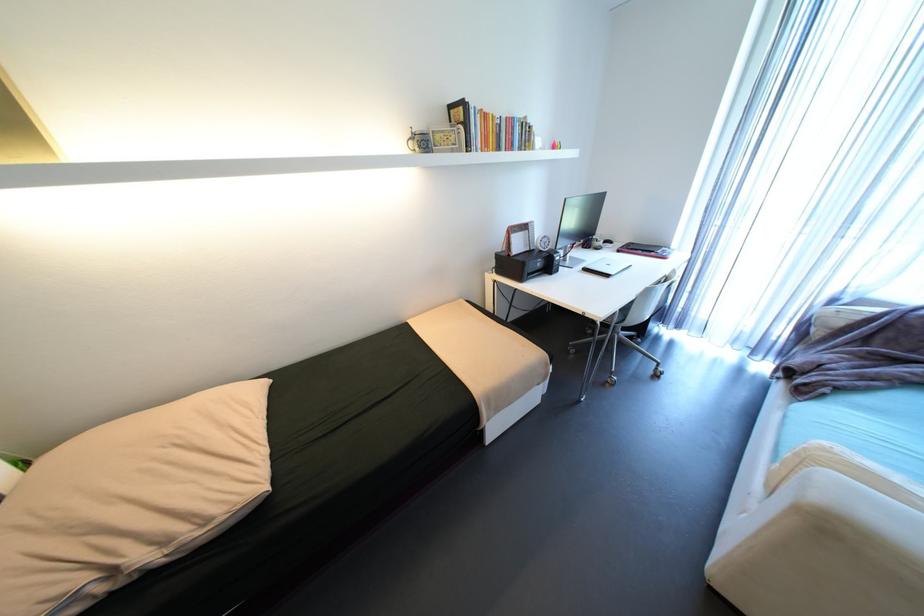
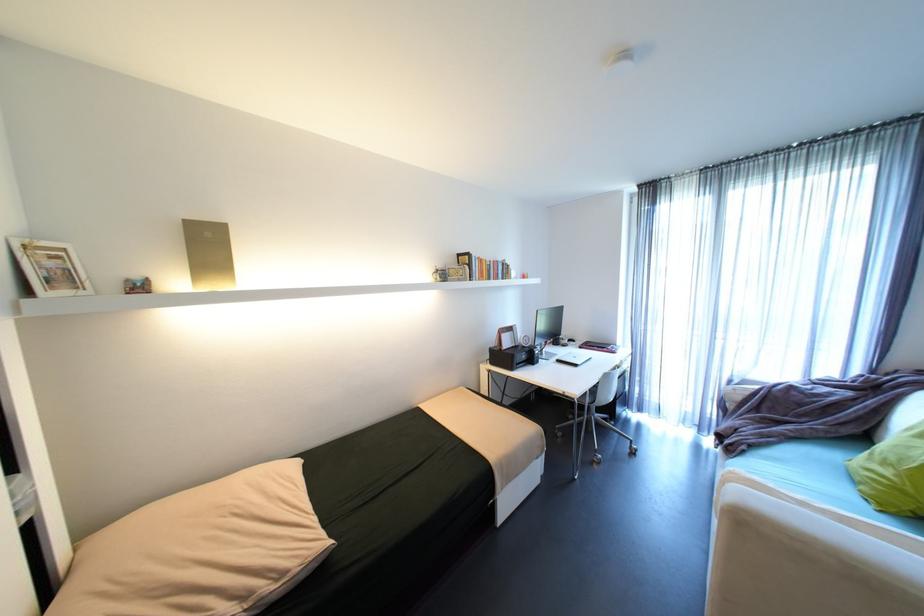
Find the pixel in the second image that matches point 621,314 in the first image.

(592, 394)